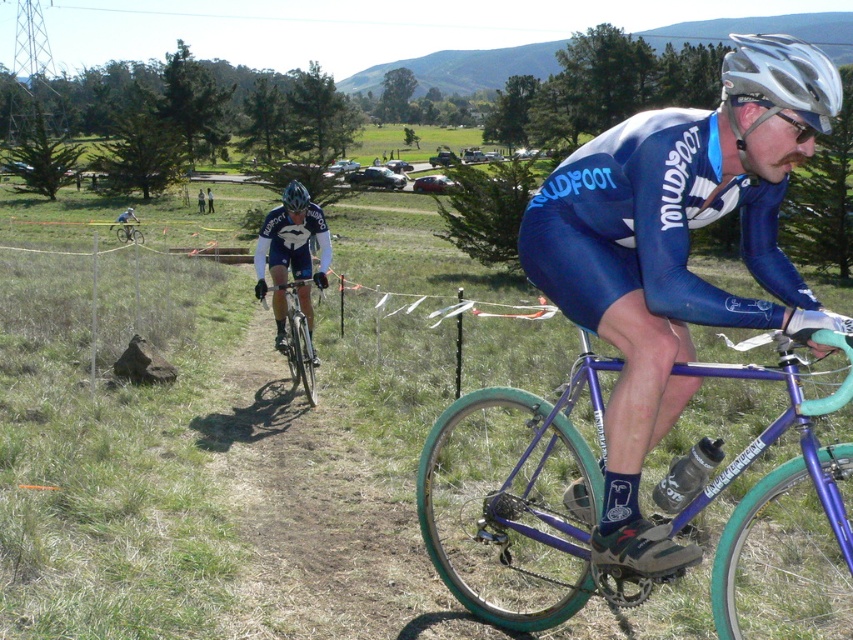
Question: Which point is farther to the camera?

Choices:
 (A) green matte bicycle at center
 (B) shiny purple bicycle at center
 (C) sunglasses at center

Answer: (A)

Question: Does shiny silver bicycle at center appear under sunglasses at center?

Choices:
 (A) yes
 (B) no

Answer: (A)

Question: Does blue/leather cycling suit at center appear on the left side of green matte bicycle at center?

Choices:
 (A) no
 (B) yes

Answer: (A)

Question: Does silver metallic helmet at upper right appear on the right side of matte black helmet at center?

Choices:
 (A) yes
 (B) no

Answer: (A)

Question: Based on their relative distances, which object is farther from the matte black helmet at center?

Choices:
 (A) silver metallic helmet at upper right
 (B) shiny purple bicycle at center
 (C) shiny silver bicycle at center

Answer: (A)

Question: Which point is closer to the camera?

Choices:
 (A) matte black helmet at center
 (B) blue/leather cycling suit at center
 (C) sunglasses at center

Answer: (B)